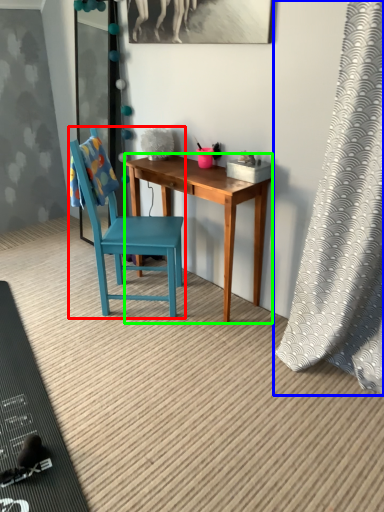
Question: Considering the real-world distances, which object is closest to chair (highlighted by a red box)? curtain (highlighted by a blue box) or desk (highlighted by a green box).

Choices:
 (A) curtain
 (B) desk

Answer: (B)